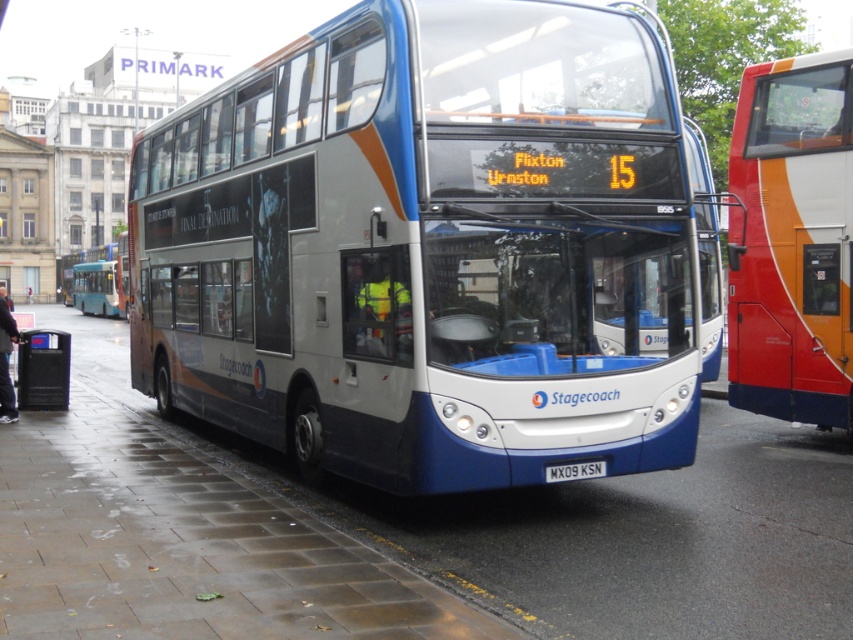
Question: Can you confirm if blue metallic bus at center is positioned above orange glossy bus at right?

Choices:
 (A) no
 (B) yes

Answer: (B)

Question: Is black plastic bus stop at lower left positioned at the back of black plastic license plate at center?

Choices:
 (A) yes
 (B) no

Answer: (A)

Question: Considering the real-world distances, which object is closest to the matte black bus at center?

Choices:
 (A) black plastic license plate at center
 (B) black plastic bus stop at lower left

Answer: (B)

Question: Which point is farther from the camera taking this photo?

Choices:
 (A) (3, 330)
 (B) (566, 122)

Answer: (A)

Question: Which point appears farthest from the camera in this image?

Choices:
 (A) (553, 467)
 (B) (38, 365)

Answer: (B)

Question: Can you confirm if wet concrete pavement at lower center is positioned below orange glossy bus at right?

Choices:
 (A) yes
 (B) no

Answer: (A)